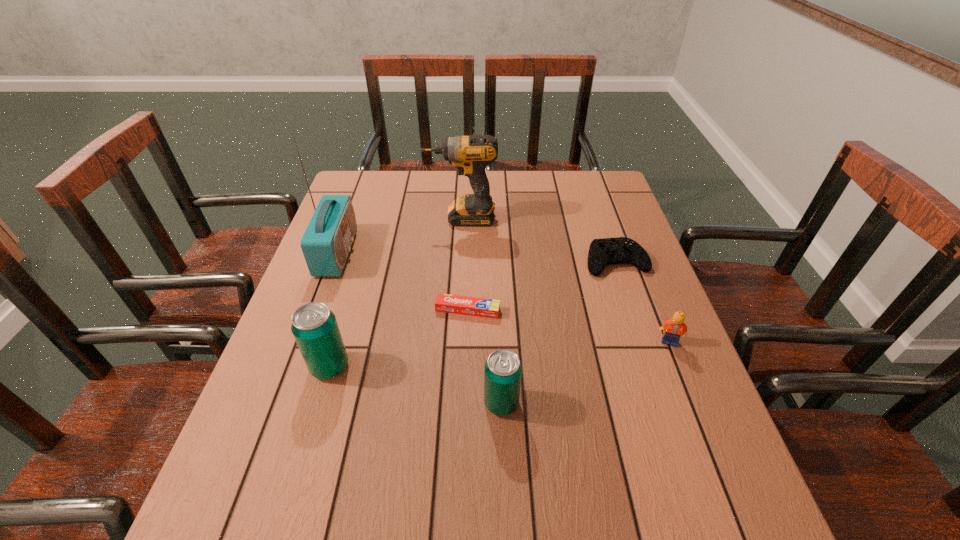
Please point out where to position a new beer can on the right to maintain spacing. Please provide its 2D coordinates. Your answer should be formatted as a tuple, i.e. [(x, y)], where the tuple contains the x and y coordinates of a point satisfying the conditions above.

[(700, 445)]